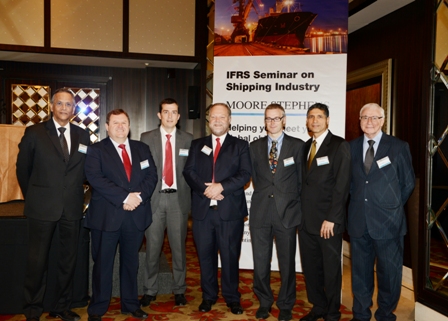
This screenshot has width=448, height=321. Identify the location of floor. point(179,315).